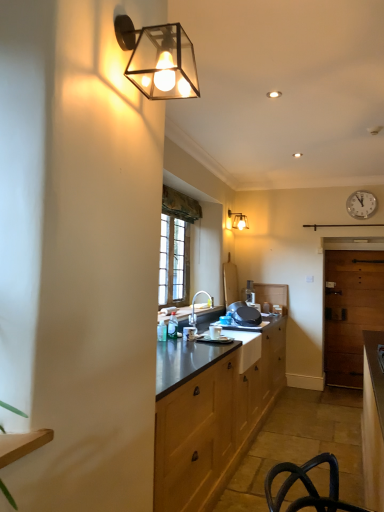
Where is `matte black wall sconce at upper left, which is counted as the first lamp, starting from the left`? This screenshot has height=512, width=384. matte black wall sconce at upper left, which is counted as the first lamp, starting from the left is located at coordinates (159, 59).

This screenshot has height=512, width=384. In order to click on wooden door at right in this screenshot , I will do `click(351, 312)`.

Describe the element at coordinates (194, 305) in the screenshot. I see `matte silver faucet at center` at that location.

In order to face matte glass wall sconce at upper center, which is counted as the first lamp, starting from the right, should I rotate leftwards or rightwards?

Rotate right and turn 6.411 degrees.

This screenshot has height=512, width=384. Identify the location of matte black wall sconce at upper left, marked as the first lamp in a front-to-back arrangement. (159, 59).

Measure the distance from matte glass wall sconce at upper center, the 2th lamp from the front, to white plastic clock at upper right.

matte glass wall sconce at upper center, the 2th lamp from the front, is 4.76 feet away from white plastic clock at upper right.

How different are the orientations of matte glass wall sconce at upper center, which is counted as the first lamp, starting from the right, and white plastic clock at upper right in degrees?

The facing directions of matte glass wall sconce at upper center, which is counted as the first lamp, starting from the right, and white plastic clock at upper right are 90.2 degrees apart.

Between point (245, 216) and point (363, 195), which one is positioned in front?

Positioned in front is point (363, 195).

I want to click on clock above the matte glass wall sconce at upper center, which is counted as the first lamp, starting from the right (from the image's perspective), so click(x=361, y=204).

Based on the photo, is matte glass wall sconce at upper center, the 2th lamp from the front, located outside matte silver faucet at center?

Yes, matte glass wall sconce at upper center, the 2th lamp from the front, is located beyond the bounds of matte silver faucet at center.

Is the position of matte glass wall sconce at upper center, the 2th lamp from the front, less distant than that of matte silver faucet at center?

No.

Which of these two, matte glass wall sconce at upper center, the 2th lamp in the left-to-right sequence, or matte silver faucet at center, stands shorter?

With less height is matte glass wall sconce at upper center, the 2th lamp in the left-to-right sequence.

From the image's perspective, between matte glass wall sconce at upper center, the 2th lamp in the left-to-right sequence, and matte silver faucet at center, which one is located above?

matte glass wall sconce at upper center, the 2th lamp in the left-to-right sequence.

Which of these two, wooden door at right or white plastic clock at upper right, stands taller?

With more height is wooden door at right.

At what (x,y) coordinates should I click in order to perform the action: click on glass door lying below the white plastic clock at upper right (from the image's perspective). Please return your answer as a coordinate pair (x, y). The height and width of the screenshot is (512, 384). Looking at the image, I should click on (351, 312).

Considering the relative sizes of wooden door at right and white plastic clock at upper right in the image provided, is wooden door at right wider than white plastic clock at upper right?

Yes.

In the scene shown: From a real-world perspective, is matte silver faucet at center under matte black wall sconce at upper left, which is the 2th lamp from right to left?

Yes, from a real-world perspective, matte silver faucet at center is under matte black wall sconce at upper left, which is the 2th lamp from right to left.

This screenshot has width=384, height=512. Identify the location of lamp that is the 2nd object located above the matte silver faucet at center (from the image's perspective). (159, 59).

Is matte silver faucet at center in front of matte black wall sconce at upper left, the second lamp positioned from the back?

No, it is behind matte black wall sconce at upper left, the second lamp positioned from the back.

Which of these two, matte silver faucet at center or matte black wall sconce at upper left, marked as the first lamp in a front-to-back arrangement, is thinner?

matte black wall sconce at upper left, marked as the first lamp in a front-to-back arrangement, is thinner.

Can you confirm if wooden door at right is wider than matte black wall sconce at upper left, marked as the first lamp in a front-to-back arrangement?

No.

Considering the positions of point (333, 305) and point (146, 80), is point (333, 305) closer or farther from the camera than point (146, 80)?

Point (333, 305) appears to be farther away from the viewer than point (146, 80).

Considering the sizes of wooden door at right and matte black wall sconce at upper left, which is counted as the first lamp, starting from the left, in the image, is wooden door at right taller or shorter than matte black wall sconce at upper left, which is counted as the first lamp, starting from the left,?

Considering their sizes, wooden door at right has more height than matte black wall sconce at upper left, which is counted as the first lamp, starting from the left.

In the scene shown: Is wooden door at right behind matte black wall sconce at upper left, the second lamp positioned from the back?

Yes, it is behind matte black wall sconce at upper left, the second lamp positioned from the back.

Is matte glass wall sconce at upper center, the 2th lamp in the left-to-right sequence, smaller than matte black wall sconce at upper left, which is the 2th lamp from right to left?

Correct, matte glass wall sconce at upper center, the 2th lamp in the left-to-right sequence, occupies less space than matte black wall sconce at upper left, which is the 2th lamp from right to left.

Considering their positions, is matte glass wall sconce at upper center, which is the first lamp from back to front, located in front of or behind matte black wall sconce at upper left, marked as the first lamp in a front-to-back arrangement?

Clearly, matte glass wall sconce at upper center, which is the first lamp from back to front, is behind matte black wall sconce at upper left, marked as the first lamp in a front-to-back arrangement.

Is matte glass wall sconce at upper center, which is counted as the first lamp, starting from the right, beside matte black wall sconce at upper left, which is the 2th lamp from right to left?

matte glass wall sconce at upper center, which is counted as the first lamp, starting from the right, is not next to matte black wall sconce at upper left, which is the 2th lamp from right to left, and they're not touching.

Is matte glass wall sconce at upper center, the 2th lamp from the front, located outside matte black wall sconce at upper left, the second lamp positioned from the back?

matte glass wall sconce at upper center, the 2th lamp from the front, is positioned outside matte black wall sconce at upper left, the second lamp positioned from the back.

Is matte glass wall sconce at upper center, which is the first lamp from back to front, facing away from wooden door at right?

No, matte glass wall sconce at upper center, which is the first lamp from back to front, is not facing the opposite direction of wooden door at right.

Considering the positions of objects matte glass wall sconce at upper center, which is the first lamp from back to front, and wooden door at right in the image provided, who is more to the left, matte glass wall sconce at upper center, which is the first lamp from back to front, or wooden door at right?

Positioned to the left is matte glass wall sconce at upper center, which is the first lamp from back to front.

Find the location of a particular element. The image size is (384, 512). the 1st lamp above the wooden door at right (from the image's perspective) is located at coordinates (238, 220).

The image size is (384, 512). Identify the location of clock lying on the right of matte glass wall sconce at upper center, which is the first lamp from back to front. (361, 204).

Find the location of a particular element. Image resolution: width=384 pixels, height=512 pixels. lamp that is behind the matte silver faucet at center is located at coordinates (238, 220).

Looking at the image, which one is located further to wooden door at right, white plastic clock at upper right or matte silver faucet at center?

matte silver faucet at center is positioned further to the anchor wooden door at right.

Looking at the image, which one is located further to wooden door at right, white plastic clock at upper right or matte black wall sconce at upper left, the second lamp positioned from the back?

matte black wall sconce at upper left, the second lamp positioned from the back, is further to wooden door at right.

Considering their positions, is wooden door at right positioned closer to white plastic clock at upper right than matte glass wall sconce at upper center, the 2th lamp from the front?

wooden door at right.

Estimate the real-world distances between objects in this image. Which object is further from wooden door at right, matte silver faucet at center or white plastic clock at upper right?

matte silver faucet at center.

When comparing their distances from matte glass wall sconce at upper center, the 2th lamp in the left-to-right sequence, does white plastic clock at upper right or wooden door at right seem further?

wooden door at right is positioned further to the anchor matte glass wall sconce at upper center, the 2th lamp in the left-to-right sequence.

Based on their spatial positions, is matte silver faucet at center or wooden door at right closer to matte glass wall sconce at upper center, the 2th lamp from the front?

matte silver faucet at center is closer to matte glass wall sconce at upper center, the 2th lamp from the front.

Considering their positions, is matte black wall sconce at upper left, which is counted as the first lamp, starting from the left, positioned closer to matte silver faucet at center than white plastic clock at upper right?

white plastic clock at upper right lies closer to matte silver faucet at center than the other object.

Considering their positions, is matte black wall sconce at upper left, the second lamp positioned from the back, positioned further to white plastic clock at upper right than matte silver faucet at center?

matte black wall sconce at upper left, the second lamp positioned from the back, lies further to white plastic clock at upper right than the other object.

At what (x,y) coordinates should I click in order to perform the action: click on tap between matte black wall sconce at upper left, which is counted as the first lamp, starting from the left, and matte glass wall sconce at upper center, which is the first lamp from back to front, from front to back. Please return your answer as a coordinate pair (x, y). The image size is (384, 512). Looking at the image, I should click on (194, 305).

Locate an element on the screen. clock between matte silver faucet at center and wooden door at right from left to right is located at coordinates (361, 204).

Where is `clock located between matte black wall sconce at upper left, marked as the first lamp in a front-to-back arrangement, and matte glass wall sconce at upper center, the 2th lamp from the front, in the depth direction`? The height and width of the screenshot is (512, 384). clock located between matte black wall sconce at upper left, marked as the first lamp in a front-to-back arrangement, and matte glass wall sconce at upper center, the 2th lamp from the front, in the depth direction is located at coordinates (361, 204).

Find the location of a particular element. The image size is (384, 512). tap positioned between matte black wall sconce at upper left, which is the 2th lamp from right to left, and wooden door at right from near to far is located at coordinates (194, 305).